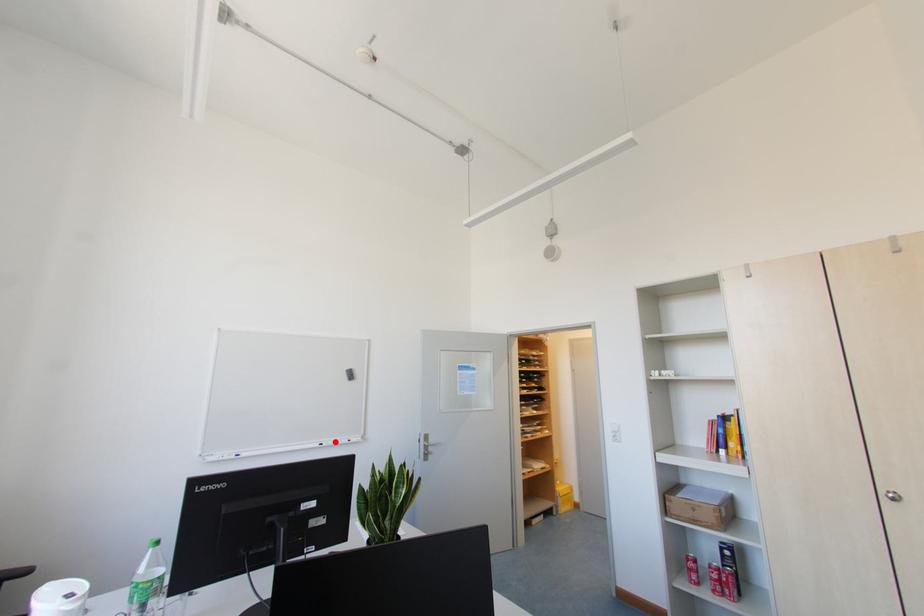
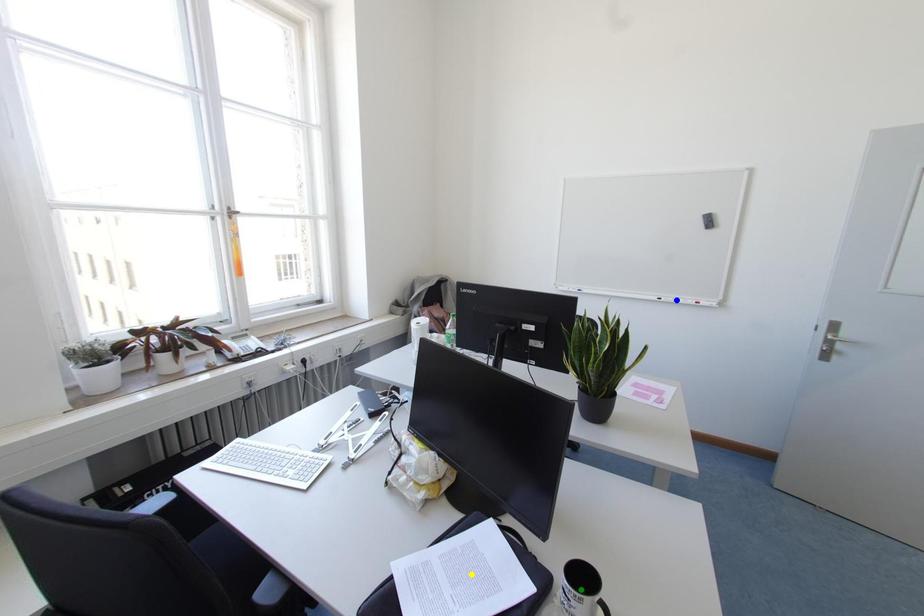
Question: I am providing you with two images of the same scene from different viewpoints. A red point is marked on the first image. You are given multiple points on the second image. Which point in image 2 represents the same 3d spot as the red point in image 1?

Choices:
 (A) yellow point
 (B) green point
 (C) blue point

Answer: (C)